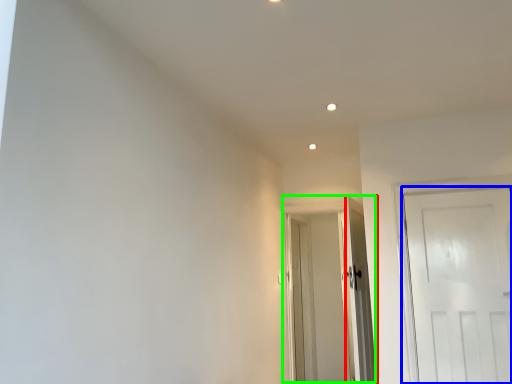
Question: Considering the real-world distances, which object is farthest from door (highlighted by a red box)? door (highlighted by a blue box) or door (highlighted by a green box)?

Choices:
 (A) door
 (B) door

Answer: (B)